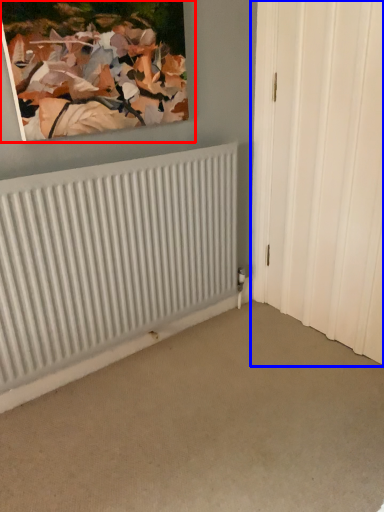
Question: Which of the following is the farthest to the observer, picture frame (highlighted by a red box) or door (highlighted by a blue box)?

Choices:
 (A) picture frame
 (B) door

Answer: (B)